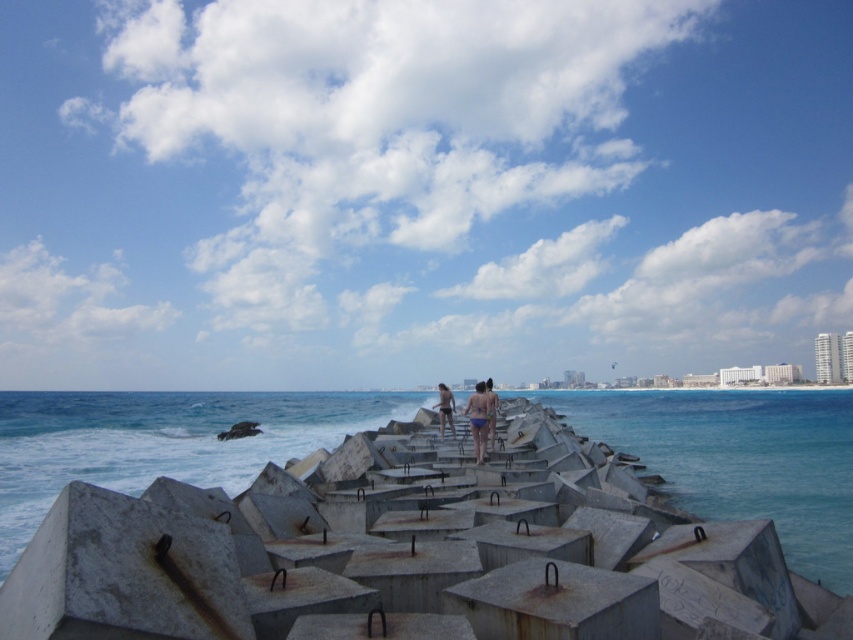
You are standing on the beach and see the rusty concrete water at center and the matte blue bikini at center. Which object is positioned to the left of the other?

The rusty concrete water at center is to the left of the matte blue bikini at center.